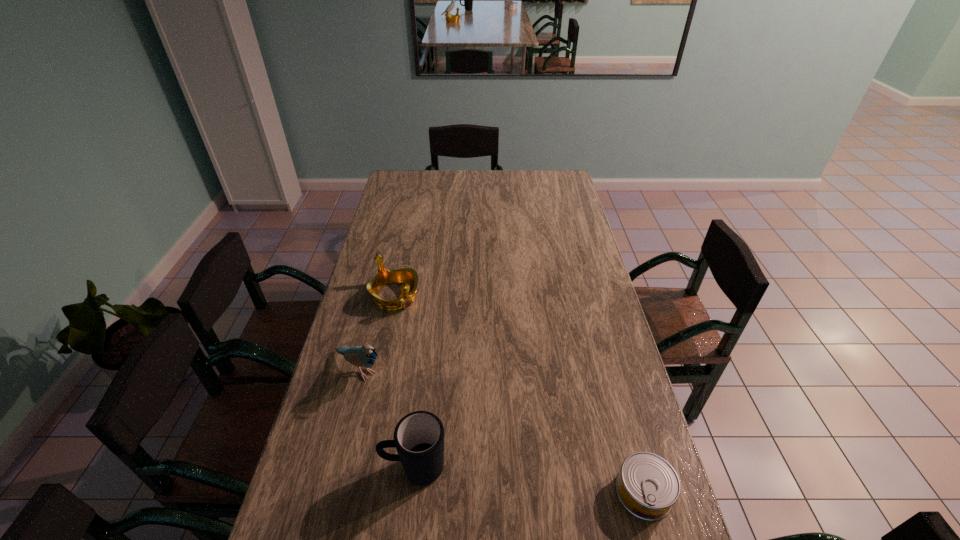
At what (x,y) coordinates should I click in order to perform the action: click on object that is at the near right corner. Please return your answer as a coordinate pair (x, y). Looking at the image, I should click on (647, 486).

Locate an element on the screen. The image size is (960, 540). vacant area at the far edge of the desktop is located at coordinates (444, 186).

In the image, there is a desktop. At what (x,y) coordinates should I click in order to perform the action: click on free space at the near edge. Please return your answer as a coordinate pair (x, y). Looking at the image, I should click on (506, 507).

Where is `vacant area at the left edge`? vacant area at the left edge is located at coordinates [x=380, y=248].

Locate an element on the screen. The width and height of the screenshot is (960, 540). vacant point at the right edge is located at coordinates (578, 261).

Identify the location of empty space that is in between the third nearest object and the rightmost object. (502, 430).

I want to click on free space that is in between the rightmost object and the bird, so click(x=502, y=430).

The width and height of the screenshot is (960, 540). What are the coordinates of `vacant space that's between the second farthest object and the mug` in the screenshot? It's located at (387, 418).

Identify the location of empty space between the shortest object and the farthest object. The width and height of the screenshot is (960, 540). (519, 394).

Where is `vacant area that lies between the farthest object and the can`? This screenshot has height=540, width=960. vacant area that lies between the farthest object and the can is located at coordinates pyautogui.click(x=519, y=394).